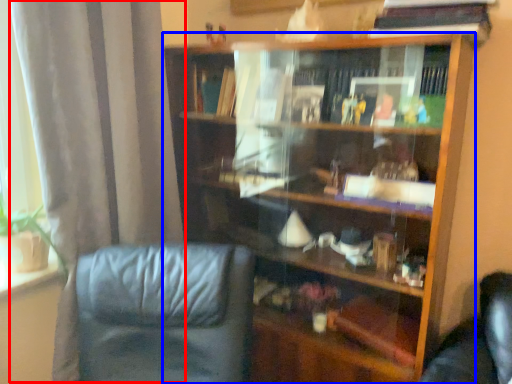
Question: Among these objects, which one is farthest to the camera, curtain (highlighted by a red box) or bookcase (highlighted by a blue box)?

Choices:
 (A) curtain
 (B) bookcase

Answer: (B)